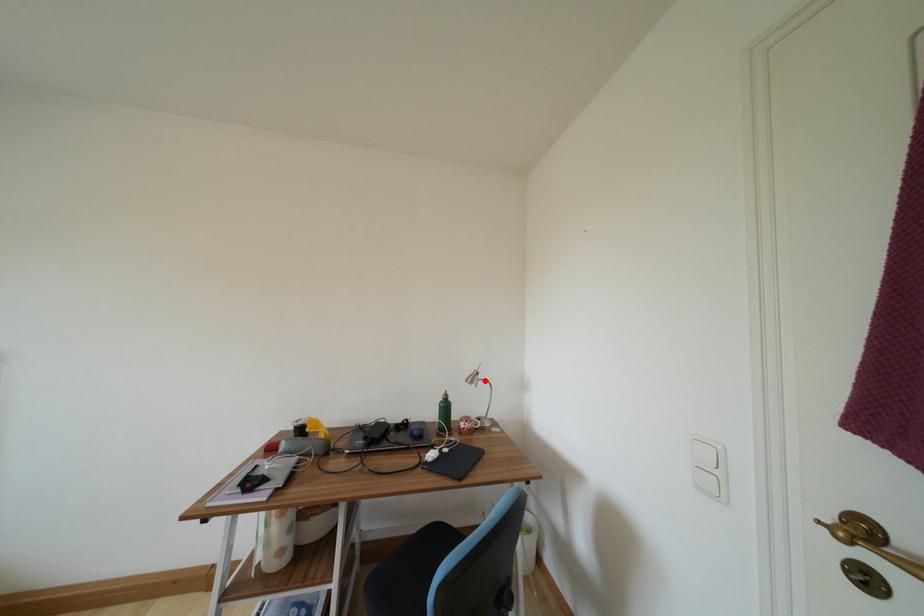
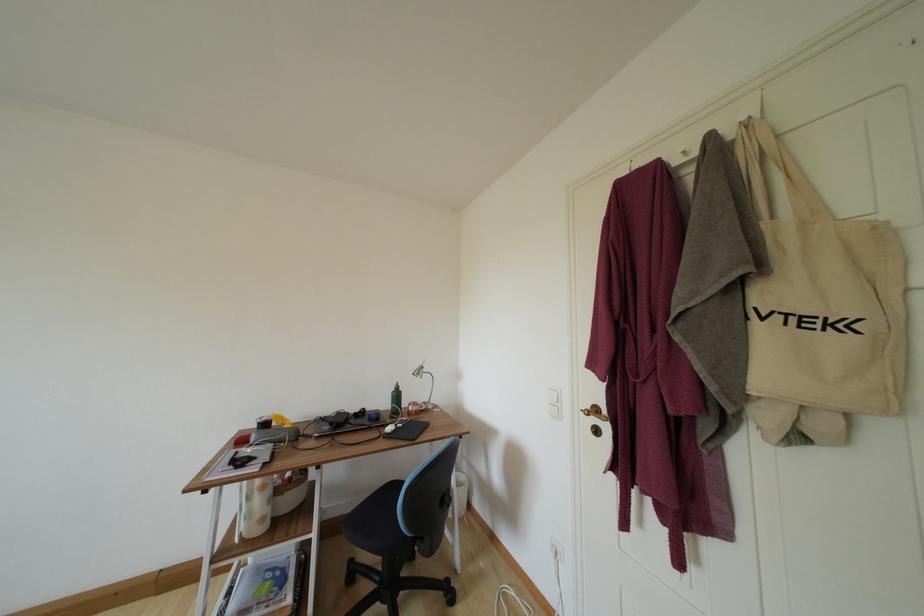
Where in the second image is the point corresponding to the highlighted location from the first image?

(430, 374)